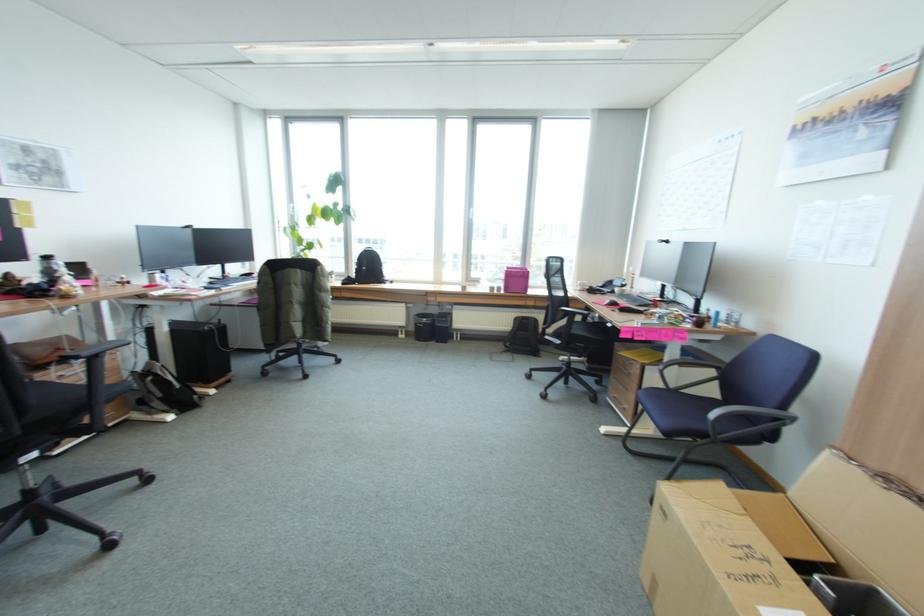
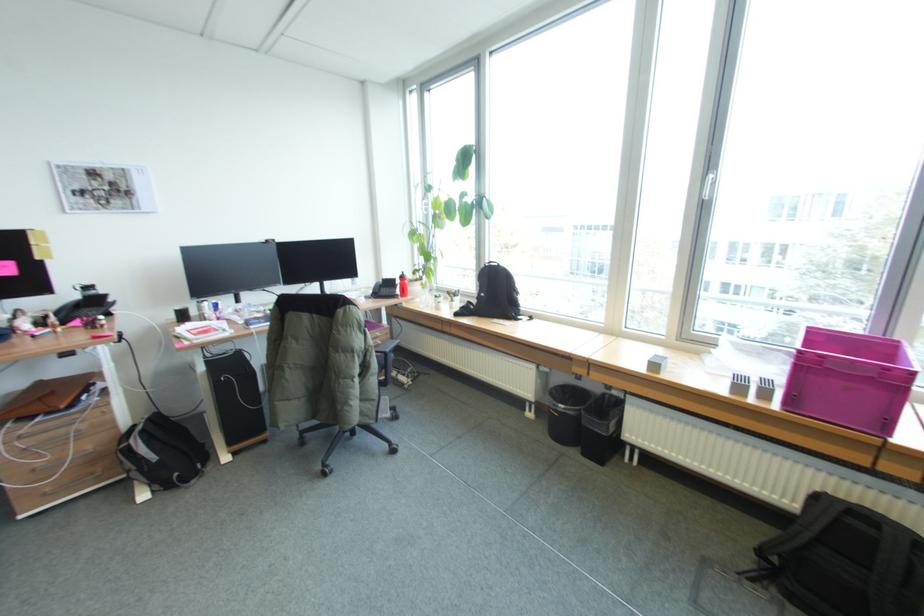
Find the pixel in the second image that matches the point at 516,353 in the first image.

(781, 593)